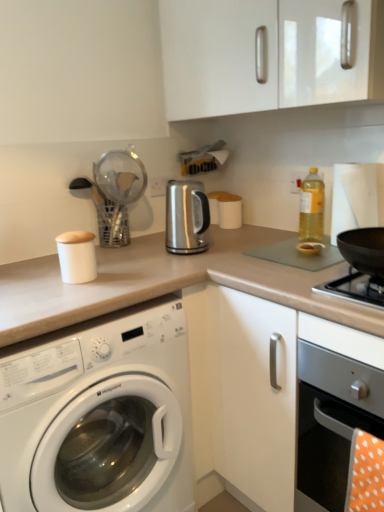
Find the location of `free space to the left of black matte wok at right`. free space to the left of black matte wok at right is located at coordinates (325, 281).